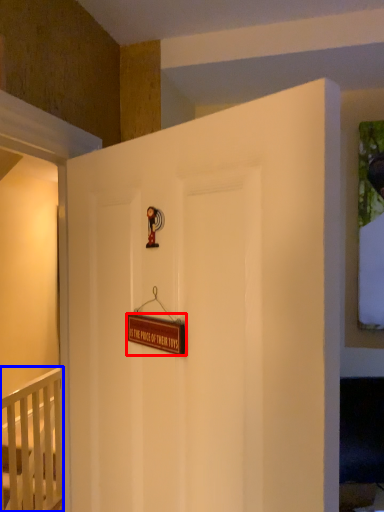
Question: Among these objects, which one is nearest to the camera, plaque (highlighted by a red box) or infant bed (highlighted by a blue box)?

Choices:
 (A) plaque
 (B) infant bed

Answer: (A)